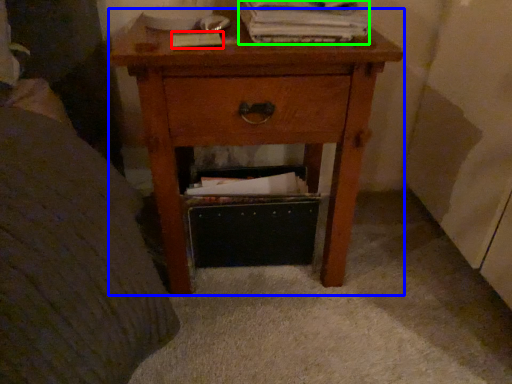
Question: Considering the real-world distances, which object is farthest from paperback book (highlighted by a red box)? nightstand (highlighted by a blue box) or paperback book (highlighted by a green box)?

Choices:
 (A) nightstand
 (B) paperback book

Answer: (A)